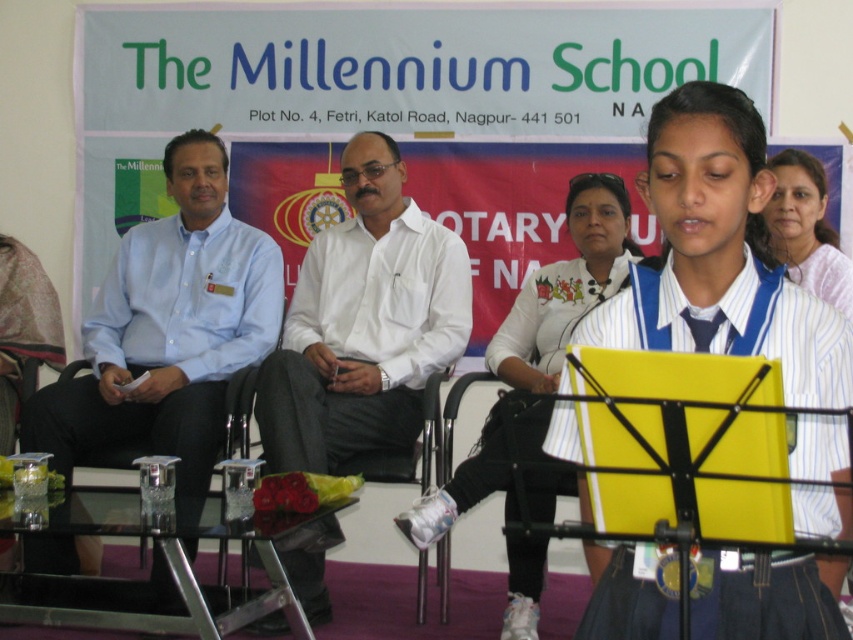
You are sitting in the audience at The Millennium School event and want to know which of the two points, point (370, 428) or point (805, 177), is closer to you. Can you determine this based on their positions?

Point (370, 428) is closer to you because it is further to the viewer than point (805, 177).